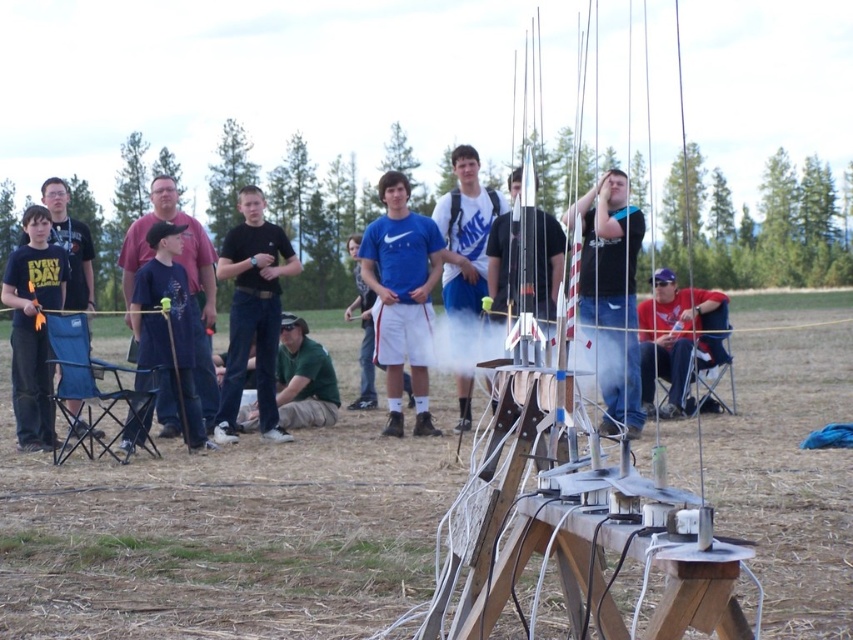
Is blue matte shirt at center positioned in front of black cotton shirt at left?

Yes, it is in front of black cotton shirt at left.

Is point (381, 253) closer to camera compared to point (86, 243)?

Yes.

Find the location of a particular element. blue matte shirt at center is located at coordinates (401, 298).

Is matte black shirt at center closer to camera compared to matte black shirt at left?

No, it is not.

Is matte black shirt at center thinner than matte black shirt at left?

No.

Does point (606, 230) lie behind point (9, 262)?

Yes, it is behind point (9, 262).

The height and width of the screenshot is (640, 853). Find the location of `matte black shirt at center`. matte black shirt at center is located at coordinates (612, 296).

Which of these two, blue fabric shirt at center or red cotton shirt at lower right, stands taller?

blue fabric shirt at center

Can you confirm if blue fabric shirt at center is taller than red cotton shirt at lower right?

Indeed, blue fabric shirt at center has a greater height compared to red cotton shirt at lower right.

At what (x,y) coordinates should I click in order to perform the action: click on blue fabric shirt at center. Please return your answer as a coordinate pair (x, y). Looking at the image, I should click on (465, 236).

Find the location of a particular element. blue fabric shirt at center is located at coordinates (465, 236).